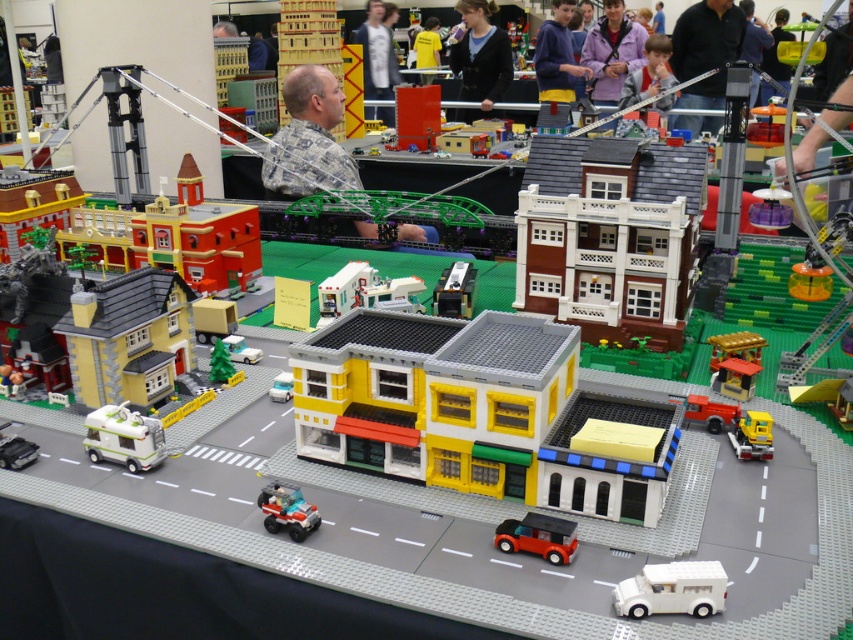
Question: Among these objects, which one is farthest from the camera?

Choices:
 (A) white matte van at lower center
 (B) white plastic camper van at lower left
 (C) yellow matte building at center
 (D) dark blue sweater at upper center

Answer: (D)

Question: Is purple matte jacket at upper center behind shiny red car at lower center?

Choices:
 (A) yes
 (B) no

Answer: (A)

Question: Which of the following is the closest to the observer?

Choices:
 (A) (440, 296)
 (B) (634, 26)

Answer: (A)

Question: Does yellow matte building at center lie behind brown matte building at center-right?

Choices:
 (A) yes
 (B) no

Answer: (B)

Question: Does brown matte building at center-right lie behind suede-like purple jacket at upper center?

Choices:
 (A) no
 (B) yes

Answer: (A)

Question: Among these points, which one is nearest to the camera?

Choices:
 (A) (606, 252)
 (B) (466, 312)
 (C) (738, 412)
 (D) (656, 74)

Answer: (C)